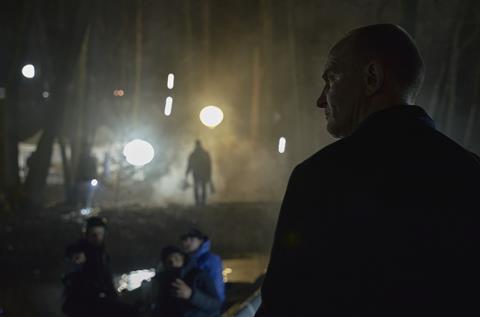
Locate an element on the screen. lights is located at coordinates (140, 158), (222, 117), (281, 146), (174, 103).